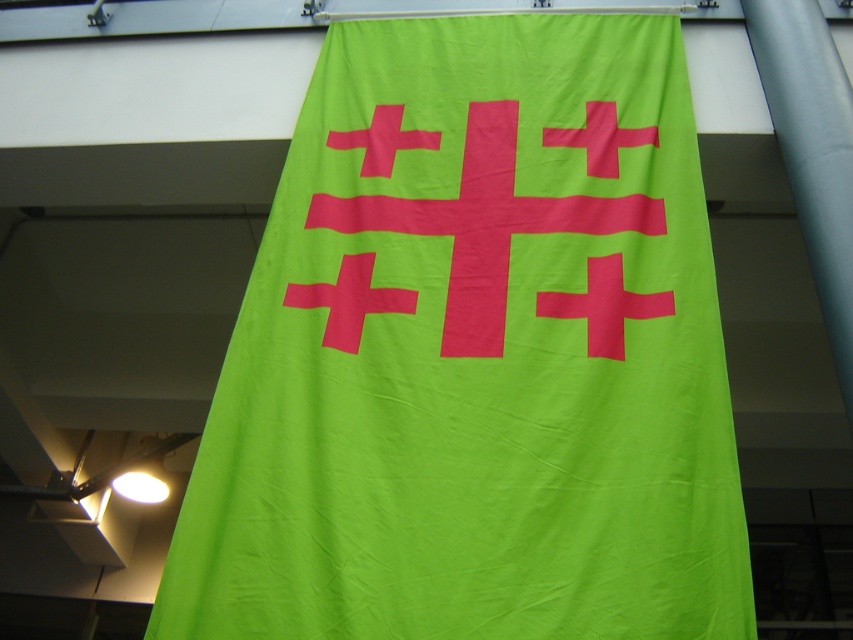
You are standing in a room with a lime green fabric flag at center. If you face the flag and look directly ahead, where would you see the flag in your field of view?

The lime green fabric flag at center is located at the center of your field of view because its 2D coordinates are nearly at the center point of the image.

You are an interior designer assessing the placement of the lime green fabric flag at center and the bright pink fabric cross at center in the image. Which object is positioned to the left?

The lime green fabric flag at center is to the left of the bright pink fabric cross at center according to the description.